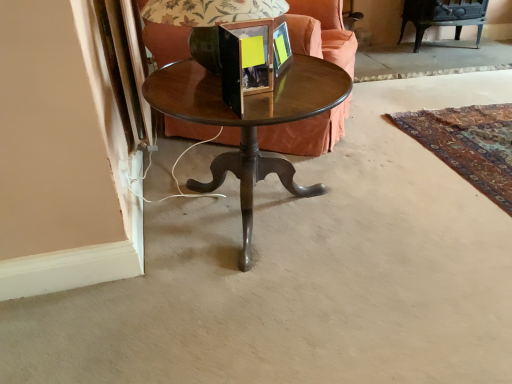
Question: Can you confirm if wooden round table at center is smaller than matte black lampshade at center?

Choices:
 (A) no
 (B) yes

Answer: (A)

Question: Is wooden round table at center outside matte black lampshade at center?

Choices:
 (A) no
 (B) yes

Answer: (B)

Question: Is matte black lampshade at center at the back of wooden round table at center?

Choices:
 (A) no
 (B) yes

Answer: (A)

Question: Is wooden round table at center to the right of matte black lampshade at center from the viewer's perspective?

Choices:
 (A) yes
 (B) no

Answer: (A)

Question: Is wooden round table at center placed right next to matte black lampshade at center?

Choices:
 (A) no
 (B) yes

Answer: (A)

Question: Is matte black picture frame at upper center, the 2th picture frame positioned from the front, taller or shorter than matte black lampshade at center?

Choices:
 (A) tall
 (B) short

Answer: (B)

Question: From a real-world perspective, is matte black picture frame at upper center, the 2th picture frame positioned from the front, positioned above or below matte black lampshade at center?

Choices:
 (A) above
 (B) below

Answer: (B)

Question: Based on their positions, is matte black picture frame at upper center, the 2th picture frame positioned from the front, located to the left or right of matte black lampshade at center?

Choices:
 (A) left
 (B) right

Answer: (B)

Question: Looking at their shapes, would you say matte black picture frame at upper center, the 2th picture frame positioned from the front, is wider or thinner than matte black lampshade at center?

Choices:
 (A) wide
 (B) thin

Answer: (B)

Question: From a real-world perspective, is matte black picture frame at upper center, marked as the first picture frame in a back-to-front arrangement, positioned above or below wooden picture frame at center, which is the 1th picture frame in front-to-back order?

Choices:
 (A) above
 (B) below

Answer: (B)

Question: Considering the positions of point (280, 41) and point (225, 33), is point (280, 41) closer or farther from the camera than point (225, 33)?

Choices:
 (A) farther
 (B) closer

Answer: (A)

Question: Which is correct: matte black picture frame at upper center, the 2th picture frame positioned from the front, is inside wooden picture frame at center, arranged as the 2th picture frame when viewed from the back, or outside of it?

Choices:
 (A) outside
 (B) inside

Answer: (A)

Question: From the image's perspective, is matte black picture frame at upper center, the 2th picture frame positioned from the front, above or below wooden picture frame at center, arranged as the 2th picture frame when viewed from the back?

Choices:
 (A) above
 (B) below

Answer: (A)

Question: From the image's perspective, relative to velvet orange couch at center, is matte black picture frame at upper center, the 2th picture frame positioned from the front, above or below?

Choices:
 (A) below
 (B) above

Answer: (A)

Question: Based on their positions, is matte black picture frame at upper center, marked as the first picture frame in a back-to-front arrangement, located to the left or right of velvet orange couch at center?

Choices:
 (A) right
 (B) left

Answer: (A)